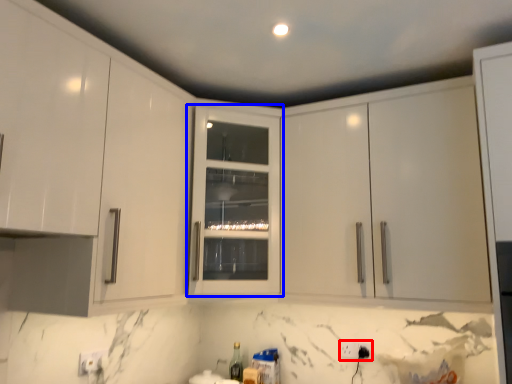
Question: Which object appears closest to the camera in this image, electric outlet (highlighted by a red box) or cabinetry (highlighted by a blue box)?

Choices:
 (A) electric outlet
 (B) cabinetry

Answer: (B)